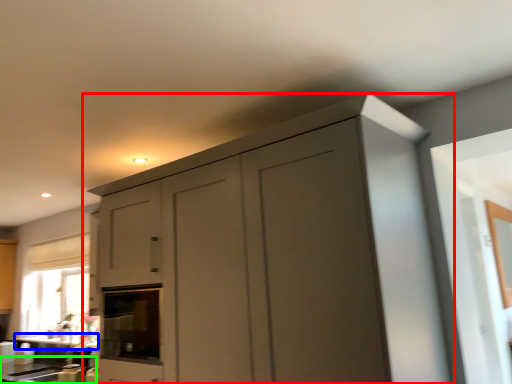
Question: Based on their relative distances, which object is farther from cupboard (highlighted by a red box)? Choose from counter top (highlighted by a blue box) and counter top (highlighted by a green box).

Choices:
 (A) counter top
 (B) counter top

Answer: (A)